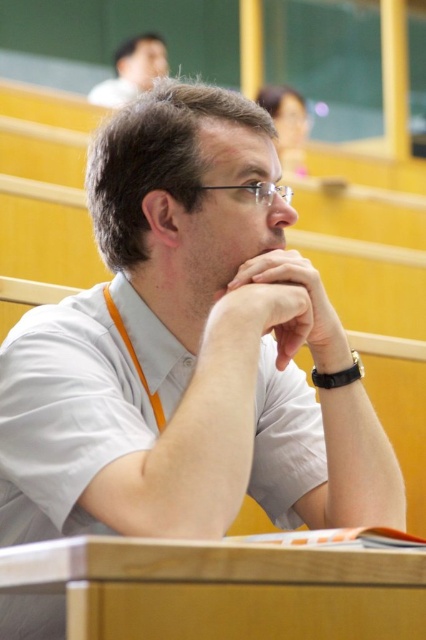
Who is shorter, matte skin hand at center or matte white shirt at upper center?

matte skin hand at center is shorter.

Does matte skin hand at center have a lesser width compared to matte white shirt at upper center?

Yes.

The image size is (426, 640). I want to click on matte skin hand at center, so click(x=310, y=298).